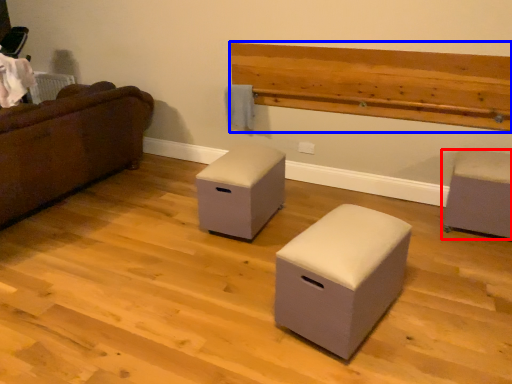
Question: Which object is closer to the camera taking this photo, furniture (highlighted by a red box) or hardwood (highlighted by a blue box)?

Choices:
 (A) furniture
 (B) hardwood

Answer: (A)